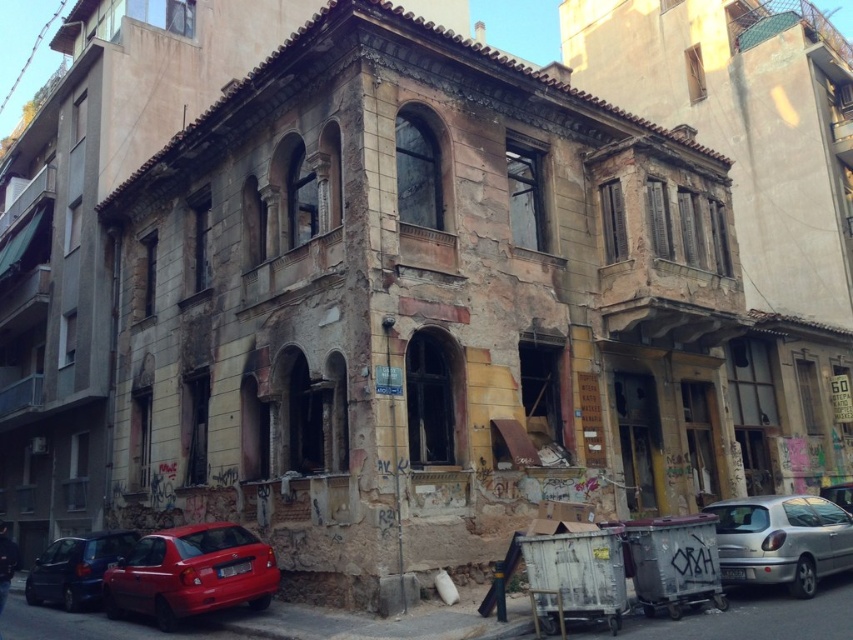
You are standing at the center of the image and see a point at coordinate (x=190, y=573). Which object does this point belong to?

The point at coordinate (x=190, y=573) belongs to the shiny red hatchback at lower left.

You are a delivery person standing at the camera position. You need to park your car, which is 4.5 meters long, in a space that requires the car to be placed exactly 10 meters away from the building. Can you park the silver metallic car at lower right in this space?

The silver metallic car at lower right is 9.71 meters away from camera. Since the required distance is 10 meters and the car is only 9.71 meters away, it is 0.29 meters too close. Therefore, you cannot park the silver metallic car at lower right in this space.

Based on the photo, you are standing at the center of the image and want to move towards the shiny red hatchback at lower left. In which direction should you move?

You should move towards the lower left direction to reach the shiny red hatchback at lower left.